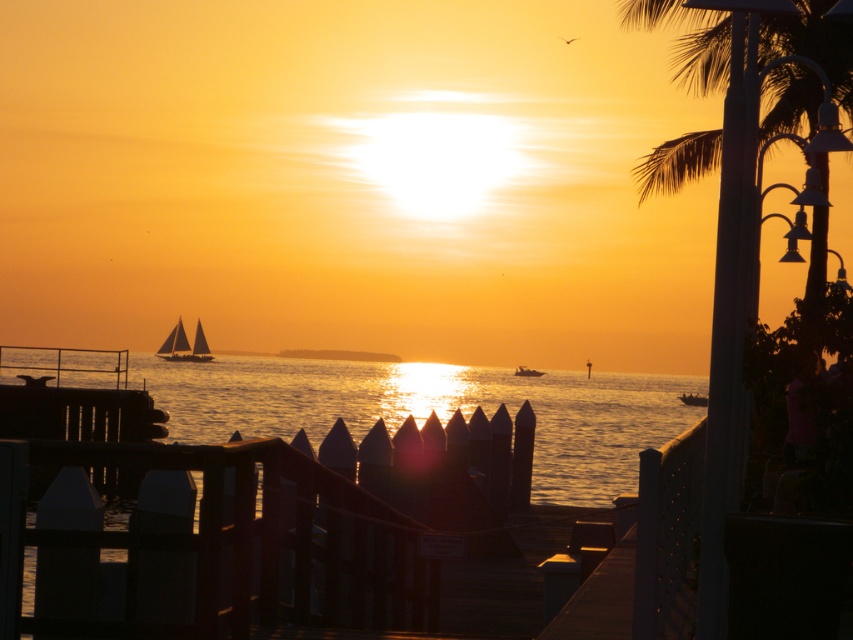
You are standing on the wooden dock and want to walk to the glistening water at center. Which direction should you move relative to the matte black sailboat at left?

You should move to the right relative to the matte black sailboat at left to reach the glistening water at center since the glistening water at center is located to the right of the matte black sailboat at left.

You are standing on the wooden dock and want to walk to the end. There is a glistening water at center and a matte black sailboat at left. Which object will you pass first as you walk towards the end of the dock?

You will first pass the matte black sailboat at left before reaching the glistening water at center because the sailboat is positioned to the left side, closer to the starting point on the dock.

You are an artist trying to paint the sunset scene. You need to decide which object, the glistening water at center or the matte black sailboat at left, requires more attention to detail because it takes up more space in the image. Which one should you focus on?

The glistening water at center is larger in size than the matte black sailboat at left, so you should focus more on the glistening water at center since it occupies a bigger portion of the image and requires more detailed work.